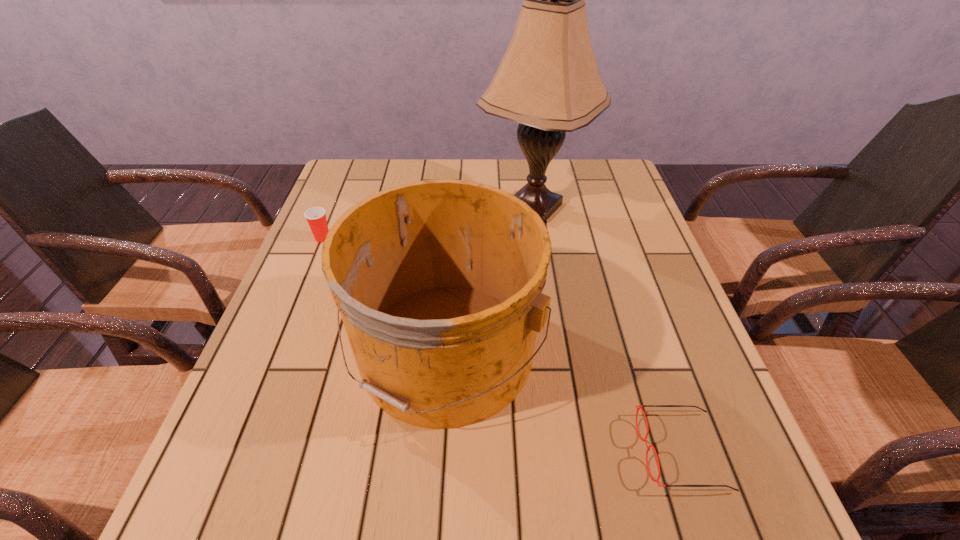
Identify the location of vacant point located 0.260m on the front-facing side of the spectacles. (492, 451).

What are the coordinates of `object that is at the far edge` in the screenshot? It's located at (548, 81).

Where is `object that is at the near edge`? The width and height of the screenshot is (960, 540). object that is at the near edge is located at coordinates (640, 406).

Locate an element on the screen. This screenshot has height=540, width=960. object that is at the left edge is located at coordinates (316, 217).

At what (x,y) coordinates should I click in order to perform the action: click on lamp situated at the right edge. Please return your answer as a coordinate pair (x, y). Looking at the image, I should click on (548, 81).

Locate an element on the screen. This screenshot has width=960, height=540. spectacles at the right edge is located at coordinates (640, 406).

At what (x,y) coordinates should I click in order to perform the action: click on object at the far right corner. Please return your answer as a coordinate pair (x, y). The width and height of the screenshot is (960, 540). Looking at the image, I should click on (548, 81).

Locate an element on the screen. Image resolution: width=960 pixels, height=540 pixels. object situated at the near right corner is located at coordinates (640, 406).

In the image, there is a desktop. Find the location of `vacant space at the far edge`. vacant space at the far edge is located at coordinates (429, 164).

Where is `vacant region at the near edge of the desktop`? This screenshot has height=540, width=960. vacant region at the near edge of the desktop is located at coordinates (347, 505).